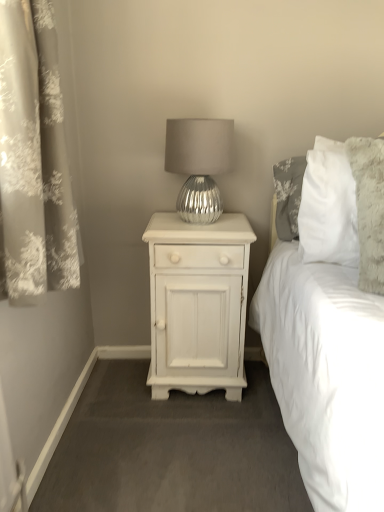
The image size is (384, 512). I want to click on vacant space underneath silver metallic lamp at center (from a real-world perspective), so click(x=198, y=223).